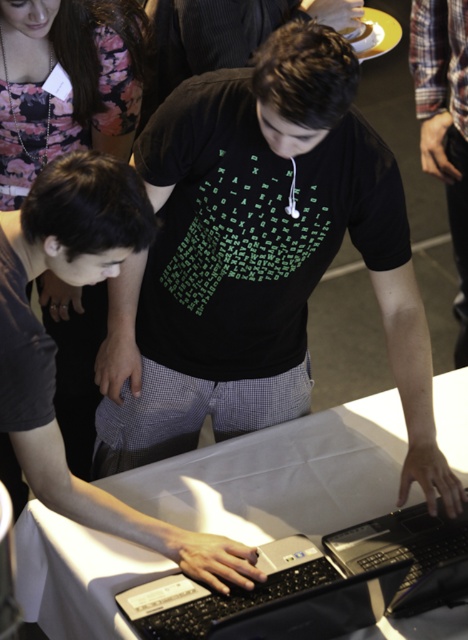
Question: Where is black matte shirt at upper left located in relation to black matte shirt at center in the image?

Choices:
 (A) left
 (B) right

Answer: (A)

Question: Is black matte shirt at upper left wider than black matte shirt at center?

Choices:
 (A) yes
 (B) no

Answer: (B)

Question: Is black matte t-shirt at center to the right of white cloth table at center from the viewer's perspective?

Choices:
 (A) yes
 (B) no

Answer: (A)

Question: Which object is positioned farthest from the white cloth table at center?

Choices:
 (A) black matte shirt at center
 (B) black matte shirt at upper left

Answer: (B)

Question: Which object appears farthest from the camera in this image?

Choices:
 (A) black matte shirt at center
 (B) white cloth table at center
 (C) black matte t-shirt at center

Answer: (B)

Question: Which is nearer to the black matte shirt at upper left?

Choices:
 (A) white cloth table at center
 (B) black matte t-shirt at center
 (C) black matte shirt at center

Answer: (B)